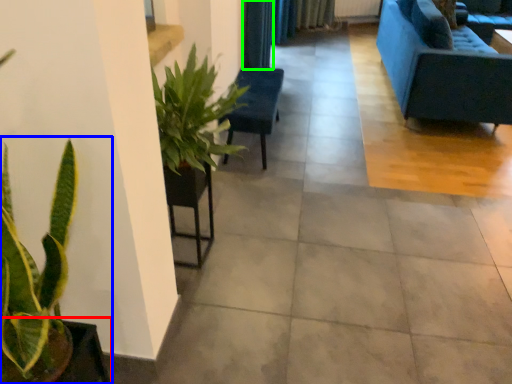
Question: Considering the real-world distances, which object is closest to flowerpot (highlighted by a red box)? houseplant (highlighted by a blue box) or curtain (highlighted by a green box).

Choices:
 (A) houseplant
 (B) curtain

Answer: (A)